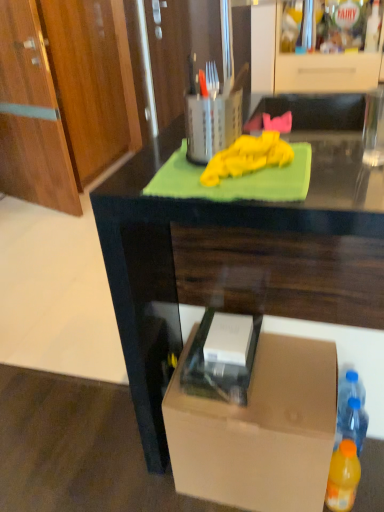
The height and width of the screenshot is (512, 384). I want to click on free location above brown cardboard box at lower right (from a real-world perspective), so click(274, 381).